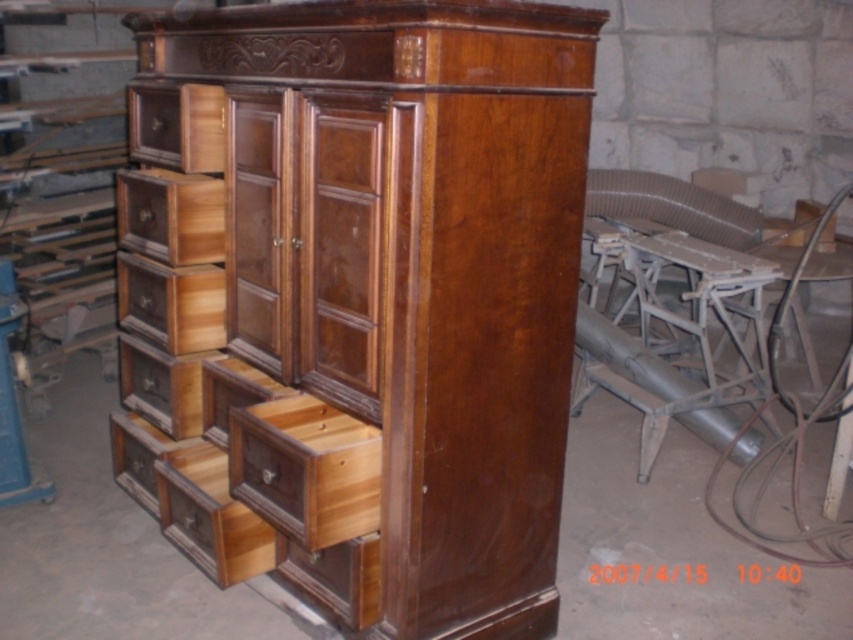
You are standing in a workshop and see a shiny brown wood dresser at center. There is a point marked at coordinates (405, 282). Where would this point be located on the shiny brown wood dresser at center?

The point at coordinates (405, 282) is located on the shiny brown wood dresser at center.

You are organizing tools in the workshop and need to place a long screwdriver. You see the wooden drawer at upper left and the wooden drawer at center. Which drawer has enough vertical space to store the screwdriver vertically?

The wooden drawer at upper left is taller than the wooden drawer at center, so it has enough vertical space to store the screwdriver vertically.

You are organizing tools in a workshop and have two wooden drawers available. The wooden drawer at upper left and the wooden drawer at center. Which drawer has a bigger space for storing larger tools?

The wooden drawer at upper left is larger in size than the wooden drawer at center, so it has a bigger space for storing larger tools.